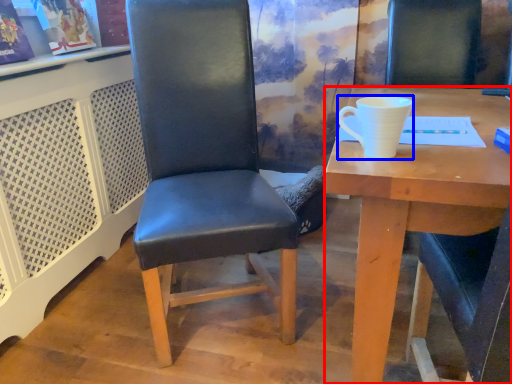
Question: Which object appears farthest to the camera in this image, desk (highlighted by a red box) or coffee cup (highlighted by a blue box)?

Choices:
 (A) desk
 (B) coffee cup

Answer: (B)